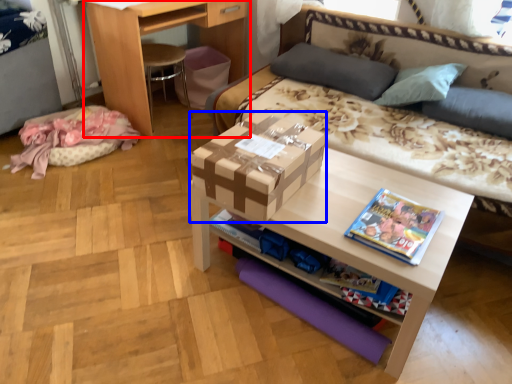
Question: Which of the following is the farthest to the observer, desk (highlighted by a red box) or box (highlighted by a blue box)?

Choices:
 (A) desk
 (B) box

Answer: (A)